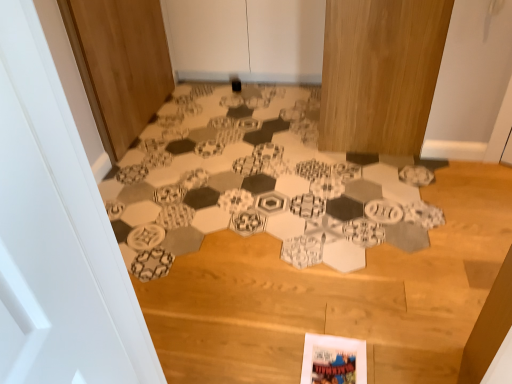
Question: Visually, is white paper at center positioned to the left or to the right of white matte door at center, which is counted as the second door, starting from the left?

Choices:
 (A) left
 (B) right

Answer: (B)

Question: Considering the positions of white paper at center and white matte door at center, which is counted as the second door, starting from the left, in the image, is white paper at center taller or shorter than white matte door at center, which is counted as the second door, starting from the left,?

Choices:
 (A) short
 (B) tall

Answer: (A)

Question: Based on their relative distances, which object is farther from the wooden door at left, marked as the 2th door in a right-to-left arrangement?

Choices:
 (A) white paper at center
 (B) white matte door at center, the 1th door from the right

Answer: (B)

Question: Based on their relative distances, which object is nearer to the wooden door at left, the first door viewed from the left?

Choices:
 (A) white paper at center
 (B) white matte door at center, which is counted as the second door, starting from the left

Answer: (A)